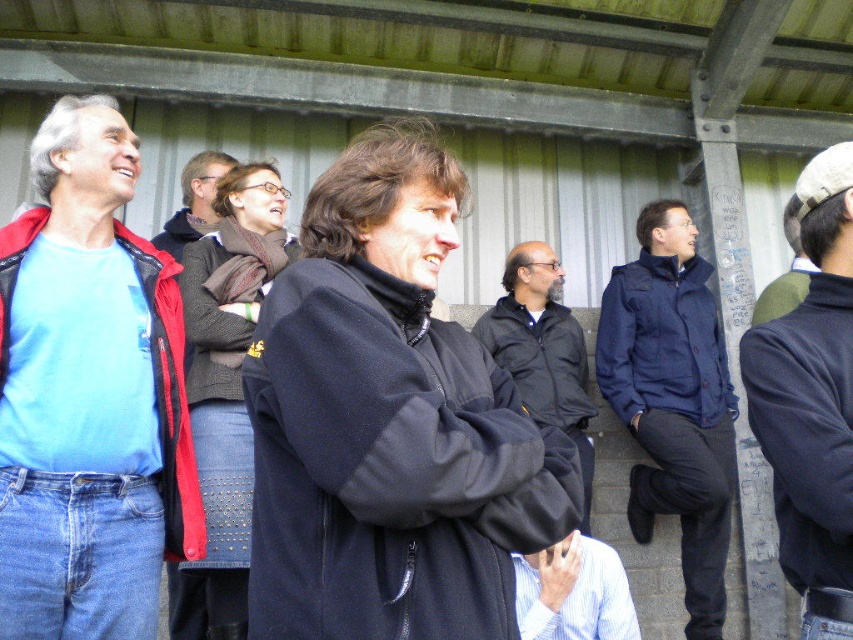
Can you confirm if knitted wool scarf at upper center is bigger than navy blue jacket at center?

Yes.

Who is lower down, knitted wool scarf at upper center or navy blue jacket at center?

knitted wool scarf at upper center is below.

Between point (250, 465) and point (669, 406), which one is positioned behind?

The point (669, 406) is more distant.

Locate an element on the screen. knitted wool scarf at upper center is located at coordinates (225, 390).

This screenshot has width=853, height=640. Describe the element at coordinates (389, 467) in the screenshot. I see `black fleece jacket at center` at that location.

Looking at this image, is black fleece jacket at center above navy blue jacket at right?

Indeed, black fleece jacket at center is positioned over navy blue jacket at right.

Does point (525, 449) come farther from viewer compared to point (689, 420)?

No, it is in front of (689, 420).

In order to click on black fleece jacket at center in this screenshot , I will do coord(389,467).

Does black fleece jacket at center have a greater width compared to dark blue sweater at center?

Correct, the width of black fleece jacket at center exceeds that of dark blue sweater at center.

Is black fleece jacket at center positioned behind dark blue sweater at center?

No.

The height and width of the screenshot is (640, 853). What do you see at coordinates (389, 467) in the screenshot? I see `black fleece jacket at center` at bounding box center [389, 467].

At what (x,y) coordinates should I click in order to perform the action: click on black fleece jacket at center. Please return your answer as a coordinate pair (x, y). This screenshot has width=853, height=640. Looking at the image, I should click on (389, 467).